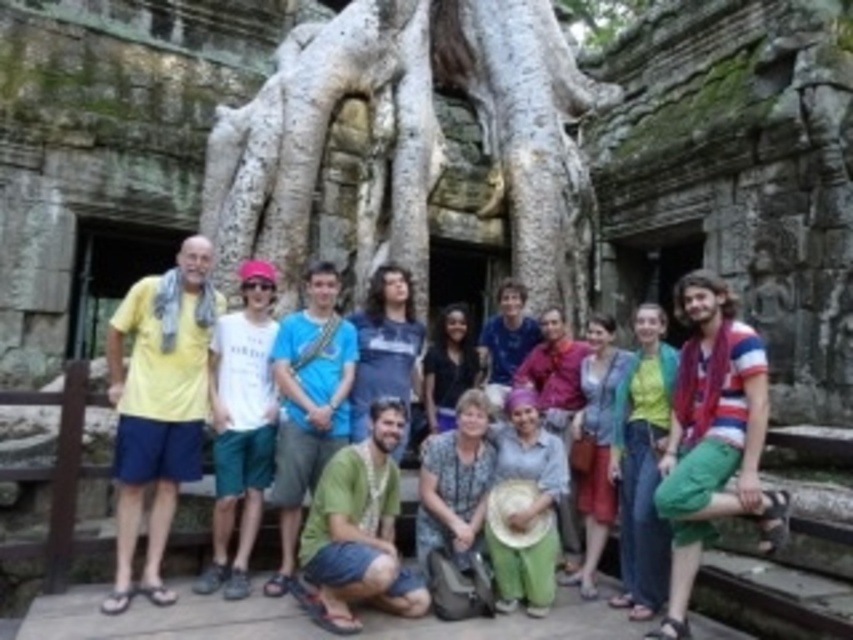
Question: Can you confirm if light blue denim jeans at center is positioned below black matte shirt at center?

Choices:
 (A) no
 (B) yes

Answer: (B)

Question: Is green denim jeans at center positioned at the back of light brown woven hat at lower center?

Choices:
 (A) yes
 (B) no

Answer: (B)

Question: Which point appears farthest from the camera in this image?

Choices:
 (A) (546, 380)
 (B) (465, 310)
 (C) (270, 436)
 (D) (576, 492)

Answer: (B)

Question: Which object is the closest to the blue cotton shirt at center?

Choices:
 (A) blue fabric shirt at center
 (B) green cotton pants at center

Answer: (A)

Question: Can you confirm if blue fabric shirt at center is positioned below green cotton pants at center?

Choices:
 (A) no
 (B) yes

Answer: (A)

Question: Which point appears closest to the camera in this image?

Choices:
 (A) (x=273, y=269)
 (B) (x=334, y=420)
 (C) (x=451, y=403)

Answer: (B)